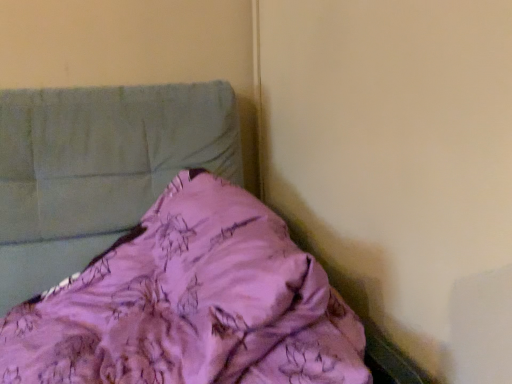
Locate an element on the screen. This screenshot has width=512, height=384. pink floral fabric at center is located at coordinates (191, 305).

What do you see at coordinates (191, 305) in the screenshot?
I see `pink floral fabric at center` at bounding box center [191, 305].

Locate an element on the screen. pink floral fabric at center is located at coordinates (191, 305).